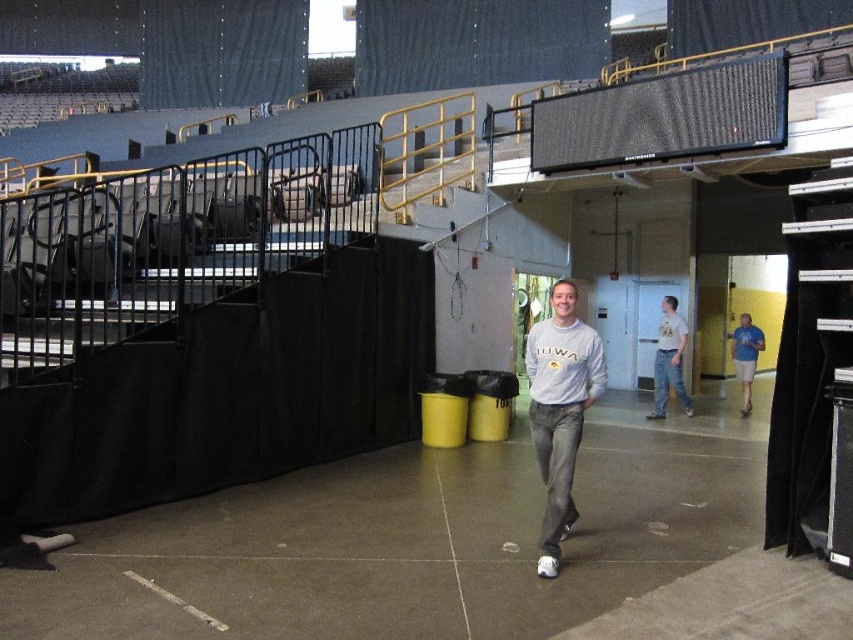
Does white cotton shirt at center have a greater width compared to blue fabric shorts at right?

Yes, white cotton shirt at center is wider than blue fabric shorts at right.

Which is more to the left, white cotton shirt at center or blue fabric shorts at right?

white cotton shirt at center

The width and height of the screenshot is (853, 640). In order to click on white cotton shirt at center in this screenshot , I will do `click(669, 358)`.

Does gray cotton sweatshirt at center have a smaller size compared to white cotton shirt at center?

Yes, gray cotton sweatshirt at center is smaller than white cotton shirt at center.

Is gray cotton sweatshirt at center bigger than white cotton shirt at center?

No, gray cotton sweatshirt at center is not bigger than white cotton shirt at center.

This screenshot has height=640, width=853. Identify the location of gray cotton sweatshirt at center. (560, 410).

Which is more to the right, gray cotton sweatshirt at center or blue fabric shorts at right?

From the viewer's perspective, blue fabric shorts at right appears more on the right side.

Is gray cotton sweatshirt at center bigger than blue fabric shorts at right?

Yes, gray cotton sweatshirt at center is bigger than blue fabric shorts at right.

Describe the element at coordinates (560, 410) in the screenshot. I see `gray cotton sweatshirt at center` at that location.

This screenshot has height=640, width=853. Find the location of `gray cotton sweatshirt at center`. gray cotton sweatshirt at center is located at coordinates (560, 410).